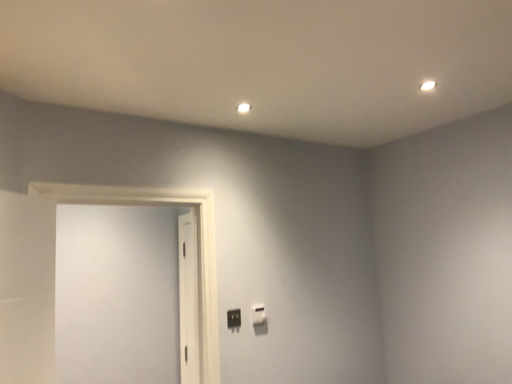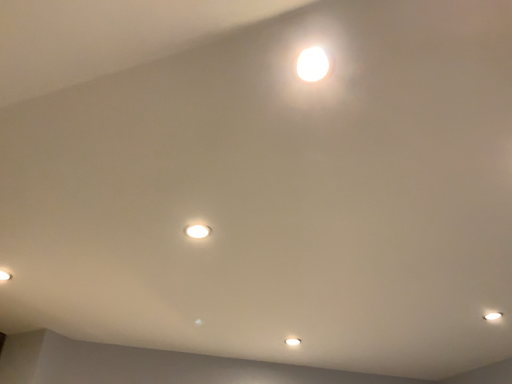
Question: Which way did the camera rotate in the video?

Choices:
 (A) rotated upward
 (B) rotated downward

Answer: (A)